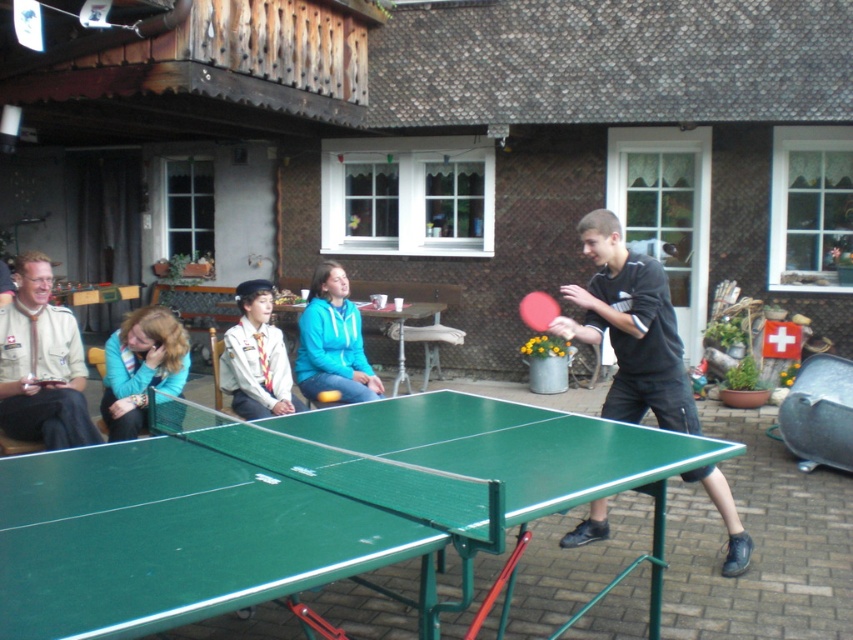
Does beige uniform at left appear over green plastic table tennis table at center?

Yes, beige uniform at left is above green plastic table tennis table at center.

Who is taller, beige uniform at left or green plastic table tennis table at center?

beige uniform at left is taller.

Between point (26, 369) and point (325, 397), which one is positioned behind?

The point (325, 397) is more distant.

Locate an element on the screen. Image resolution: width=853 pixels, height=640 pixels. beige uniform at left is located at coordinates (41, 364).

Does black matte ping pong paddle at right appear on the right side of teal fabric jacket at lower left?

Correct, you'll find black matte ping pong paddle at right to the right of teal fabric jacket at lower left.

Which is more to the right, black matte ping pong paddle at right or teal fabric jacket at lower left?

From the viewer's perspective, black matte ping pong paddle at right appears more on the right side.

The width and height of the screenshot is (853, 640). What do you see at coordinates (631, 328) in the screenshot? I see `black matte ping pong paddle at right` at bounding box center [631, 328].

Where is `black matte ping pong paddle at right`? black matte ping pong paddle at right is located at coordinates (631, 328).

Does point (349, 397) lie in front of point (322, 394)?

No, (349, 397) is behind (322, 394).

Which is more to the right, matte blue jacket at center or green plastic table tennis table at center?

Positioned to the right is green plastic table tennis table at center.

Find the location of a particular element. The image size is (853, 640). matte blue jacket at center is located at coordinates (332, 340).

The image size is (853, 640). Find the location of `matte blue jacket at center`. matte blue jacket at center is located at coordinates (332, 340).